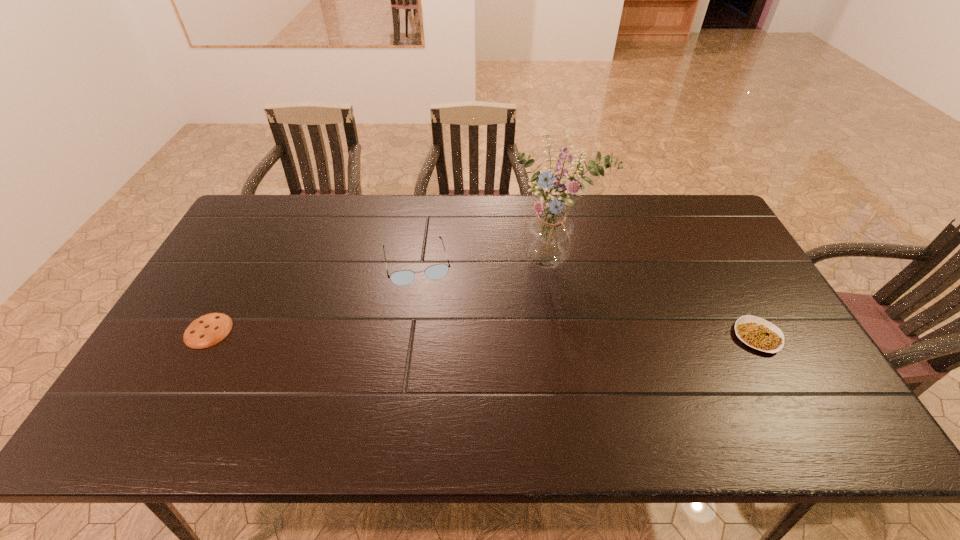
You are a GUI agent. You are given a task and a screenshot of the screen. Output one action in this format:
    pyautogui.click(x=<x>, y=<y>)
    Task: Click on the free space located on the lenses of the spectacles
    The height and width of the screenshot is (540, 960).
    Given the screenshot: What is the action you would take?
    pyautogui.click(x=430, y=323)

Identify the location of vacant space positioned on the lenses of the spectacles. (426, 307).

Find the location of a particular element. free space located on the lenses of the spectacles is located at coordinates (442, 372).

The height and width of the screenshot is (540, 960). I want to click on vacant space located 0.230m on the front-facing side of the tallest object, so click(x=556, y=343).

At what (x,y) coordinates should I click in order to perform the action: click on blank space located on the front-facing side of the tallest object. Please return your answer as a coordinate pair (x, y). This screenshot has height=540, width=960. Looking at the image, I should click on (556, 370).

Identify the location of free location located 0.130m on the front-facing side of the tallest object. The width and height of the screenshot is (960, 540). (555, 314).

Where is `object that is at the left edge`? This screenshot has height=540, width=960. object that is at the left edge is located at coordinates (208, 330).

In order to click on object present at the right edge in this screenshot , I will do click(759, 334).

Locate an element on the screen. This screenshot has width=960, height=540. free space at the far edge is located at coordinates (303, 206).

The image size is (960, 540). In order to click on free space at the near edge in this screenshot , I will do pyautogui.click(x=689, y=387).